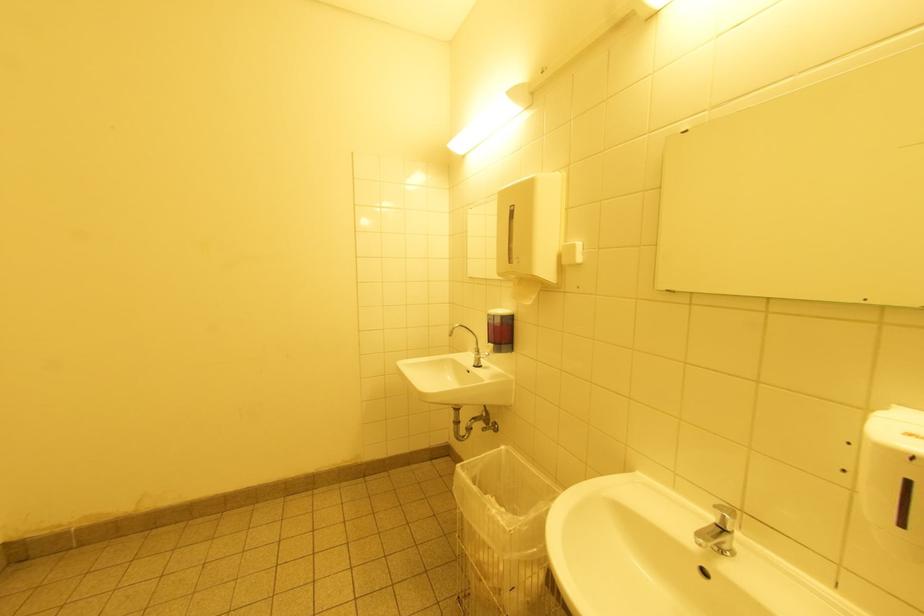
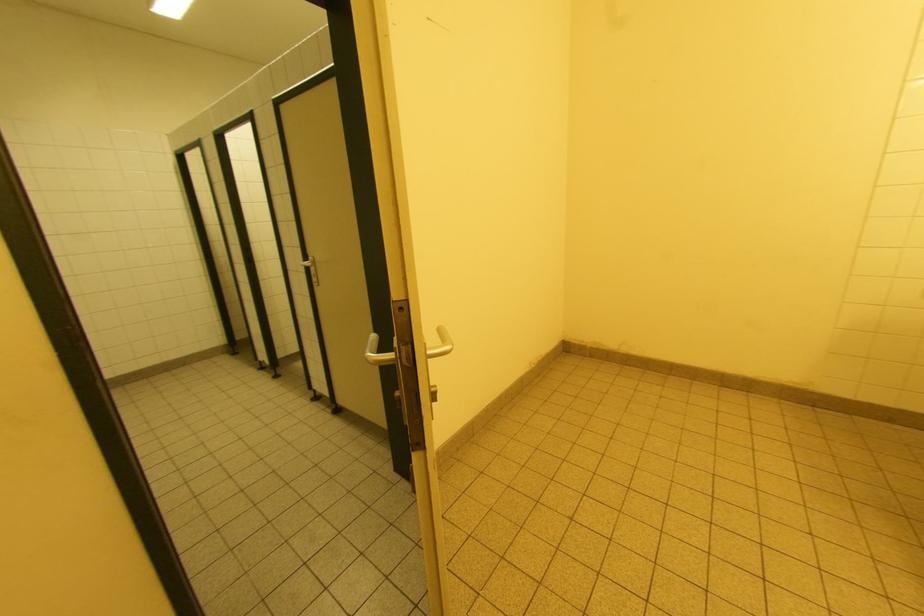
Question: The first image is from the beginning of the video and the second image is from the end. How did the camera likely rotate when shooting the video?

Choices:
 (A) Left
 (B) Right
 (C) Up
 (D) Down

Answer: (A)